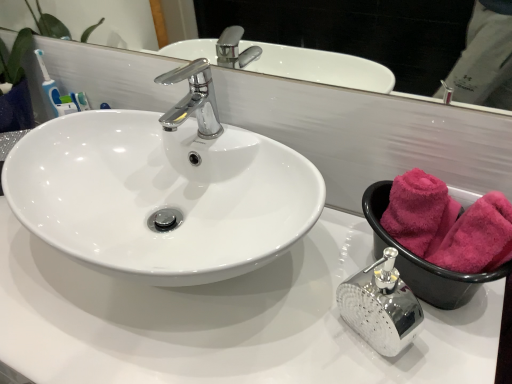
Locate an element on the screen. The height and width of the screenshot is (384, 512). chrome/metallic faucet at center is located at coordinates (193, 99).

Describe the element at coordinates (423, 260) in the screenshot. Image resolution: width=512 pixels, height=384 pixels. I see `pink soft towel at right` at that location.

Describe the element at coordinates (224, 320) in the screenshot. The image size is (512, 384). I see `white glossy counter top at center` at that location.

Where is `pink fluffy towels at right, positioned as the second bath towel in back-to-front order`? The image size is (512, 384). pink fluffy towels at right, positioned as the second bath towel in back-to-front order is located at coordinates (478, 237).

Image resolution: width=512 pixels, height=384 pixels. Describe the element at coordinates (108, 21) in the screenshot. I see `glossy white mirror at upper center` at that location.

What do you see at coordinates (163, 189) in the screenshot?
I see `white glossy sink at center` at bounding box center [163, 189].

In order to face pink fluffy towel at right, which appears as the second bath towel when viewed from the front, should I rotate leftwards or rightwards?

Turn right by 21.317 degrees to look at pink fluffy towel at right, which appears as the second bath towel when viewed from the front.

I want to click on polished chrome soap dispenser at lower right, so [x=380, y=306].

Can you confirm if glossy white mirror at upper center is taller than white glossy counter top at center?

In fact, glossy white mirror at upper center may be shorter than white glossy counter top at center.

From the picture: How different are the orientations of glossy white mirror at upper center and white glossy counter top at center in degrees?

They differ by 0.0691 degrees in their facing directions.

Does glossy white mirror at upper center have a smaller size compared to white glossy counter top at center?

Yes, glossy white mirror at upper center is smaller than white glossy counter top at center.

Visually, is glossy white mirror at upper center positioned to the left or to the right of white glossy counter top at center?

glossy white mirror at upper center is to the right of white glossy counter top at center.

Is white glossy counter top at center directly adjacent to pink fluffy towels at right, positioned as the first bath towel in front-to-back order?

There is a gap between white glossy counter top at center and pink fluffy towels at right, positioned as the first bath towel in front-to-back order.

From the image's perspective, is white glossy counter top at center above or below pink fluffy towels at right, positioned as the second bath towel in back-to-front order?

From the image's perspective, white glossy counter top at center appears below pink fluffy towels at right, positioned as the second bath towel in back-to-front order.

Is white glossy counter top at center taller or shorter than pink fluffy towels at right, positioned as the first bath towel in front-to-back order?

In the image, white glossy counter top at center appears to be taller than pink fluffy towels at right, positioned as the first bath towel in front-to-back order.

Starting from the white glossy counter top at center, which bath towel is the 2nd one to the right? Please provide its 2D coordinates.

[(478, 237)]

Measure the distance from chrome/metallic faucet at center to polished chrome soap dispenser at lower right.

chrome/metallic faucet at center is 16.69 inches from polished chrome soap dispenser at lower right.

From a real-world perspective, which is physically below, chrome/metallic faucet at center or polished chrome soap dispenser at lower right?

polished chrome soap dispenser at lower right, from a real-world perspective.

Is chrome/metallic faucet at center positioned far away from polished chrome soap dispenser at lower right?

No, there isn't a large distance between chrome/metallic faucet at center and polished chrome soap dispenser at lower right.

Consider the image. What's the angular difference between chrome/metallic faucet at center and polished chrome soap dispenser at lower right's facing directions?

chrome/metallic faucet at center and polished chrome soap dispenser at lower right are facing 0.000707 degrees away from each other.

Considering the positions of objects pink fluffy towel at right, which appears as the second bath towel when viewed from the front, and glossy white mirror at upper center in the image provided, who is more to the left, pink fluffy towel at right, which appears as the second bath towel when viewed from the front, or glossy white mirror at upper center?

glossy white mirror at upper center is more to the left.

Between pink fluffy towel at right, which appears as the second bath towel when viewed from the front, and glossy white mirror at upper center, which one has more height?

With more height is glossy white mirror at upper center.

Is pink fluffy towel at right, which appears as the second bath towel when viewed from the front, in front of or behind glossy white mirror at upper center in the image?

In the image, pink fluffy towel at right, which appears as the second bath towel when viewed from the front, appears behind glossy white mirror at upper center.

From the picture: Based on their sizes in the image, would you say chrome/metallic faucet at center is bigger or smaller than white glossy counter top at center?

In the image, chrome/metallic faucet at center appears to be smaller than white glossy counter top at center.

What are the coordinates of `tap above the white glossy counter top at center (from a real-world perspective)` in the screenshot? It's located at (193, 99).

Is white glossy counter top at center a part of chrome/metallic faucet at center?

No, white glossy counter top at center is located outside of chrome/metallic faucet at center.

From the image's perspective, relative to white glossy counter top at center, is chrome/metallic faucet at center above or below?

From the image's perspective, chrome/metallic faucet at center appears above white glossy counter top at center.

Which of these two, white glossy counter top at center or chrome/metallic faucet at center, is smaller?

Smaller between the two is chrome/metallic faucet at center.

Between white glossy counter top at center and chrome/metallic faucet at center, which one appears on the right side from the viewer's perspective?

From the viewer's perspective, chrome/metallic faucet at center appears more on the right side.

How many degrees apart are the facing directions of white glossy counter top at center and chrome/metallic faucet at center?

There is a 0.105-degree angle between the facing directions of white glossy counter top at center and chrome/metallic faucet at center.

Considering the positions of point (120, 300) and point (164, 80), is point (120, 300) closer or farther from the camera than point (164, 80)?

Clearly, point (120, 300) is closer to the camera than point (164, 80).

Is pink soft towel at right located within polished chrome soap dispenser at lower right?

That's incorrect, pink soft towel at right is not inside polished chrome soap dispenser at lower right.

Which object is thinner, polished chrome soap dispenser at lower right or pink soft towel at right?

With smaller width is polished chrome soap dispenser at lower right.

Is polished chrome soap dispenser at lower right taller or shorter than pink soft towel at right?

→ Considering their sizes, polished chrome soap dispenser at lower right has more height than pink soft towel at right.

Considering the relative positions of polished chrome soap dispenser at lower right and pink soft towel at right in the image provided, is polished chrome soap dispenser at lower right to the right of pink soft towel at right from the viewer's perspective?

Incorrect, polished chrome soap dispenser at lower right is not on the right side of pink soft towel at right.

I want to click on mirror behind the white glossy counter top at center, so click(108, 21).

Where is `counter top that is in front of the pink fluffy towels at right, positioned as the first bath towel in front-to-back order`? The width and height of the screenshot is (512, 384). counter top that is in front of the pink fluffy towels at right, positioned as the first bath towel in front-to-back order is located at coordinates (224, 320).

Looking at the image, which one is located closer to polished chrome soap dispenser at lower right, chrome/metallic faucet at center or pink soft towel at right?

Based on the image, pink soft towel at right appears to be nearer to polished chrome soap dispenser at lower right.

Which object lies further to the anchor point pink fluffy towels at right, positioned as the second bath towel in back-to-front order, chrome/metallic faucet at center or pink fluffy towel at right, which appears as the second bath towel when viewed from the front?

Based on the image, chrome/metallic faucet at center appears to be further to pink fluffy towels at right, positioned as the second bath towel in back-to-front order.

Estimate the real-world distances between objects in this image. Which object is further from pink fluffy towels at right, positioned as the second bath towel in back-to-front order, glossy white mirror at upper center or pink soft towel at right?

glossy white mirror at upper center lies further to pink fluffy towels at right, positioned as the second bath towel in back-to-front order, than the other object.

From the image, which object appears to be farther from pink fluffy towels at right, positioned as the second bath towel in back-to-front order, pink soft towel at right or pink fluffy towel at right, which appears as the second bath towel when viewed from the front?

Among the two, pink fluffy towel at right, which appears as the second bath towel when viewed from the front, is located further to pink fluffy towels at right, positioned as the second bath towel in back-to-front order.

When comparing their distances from polished chrome soap dispenser at lower right, does pink fluffy towels at right, positioned as the second bath towel in back-to-front order, or glossy white mirror at upper center seem closer?

The object closer to polished chrome soap dispenser at lower right is pink fluffy towels at right, positioned as the second bath towel in back-to-front order.

Based on their spatial positions, is pink fluffy towel at right, which appears as the second bath towel when viewed from the front, or chrome/metallic faucet at center further from glossy white mirror at upper center?

Among the two, pink fluffy towel at right, which appears as the second bath towel when viewed from the front, is located further to glossy white mirror at upper center.

When comparing their distances from glossy white mirror at upper center, does pink soft towel at right or chrome/metallic faucet at center seem closer?

chrome/metallic faucet at center lies closer to glossy white mirror at upper center than the other object.

Based on their spatial positions, is polished chrome soap dispenser at lower right or white glossy counter top at center further from pink soft towel at right?

white glossy counter top at center is further to pink soft towel at right.

Locate an element on the screen. mirror between white glossy sink at center and pink soft towel at right is located at coordinates (108, 21).

Where is `soap dispenser located between chrome/metallic faucet at center and pink soft towel at right in the left-right direction`? Image resolution: width=512 pixels, height=384 pixels. soap dispenser located between chrome/metallic faucet at center and pink soft towel at right in the left-right direction is located at coordinates (380, 306).

This screenshot has width=512, height=384. I want to click on bath towel between chrome/metallic faucet at center and pink fluffy towels at right, positioned as the first bath towel in front-to-back order, so click(x=419, y=212).

This screenshot has height=384, width=512. Find the location of `tap located between white glossy sink at center and polished chrome soap dispenser at lower right in the left-right direction`. tap located between white glossy sink at center and polished chrome soap dispenser at lower right in the left-right direction is located at coordinates (193, 99).